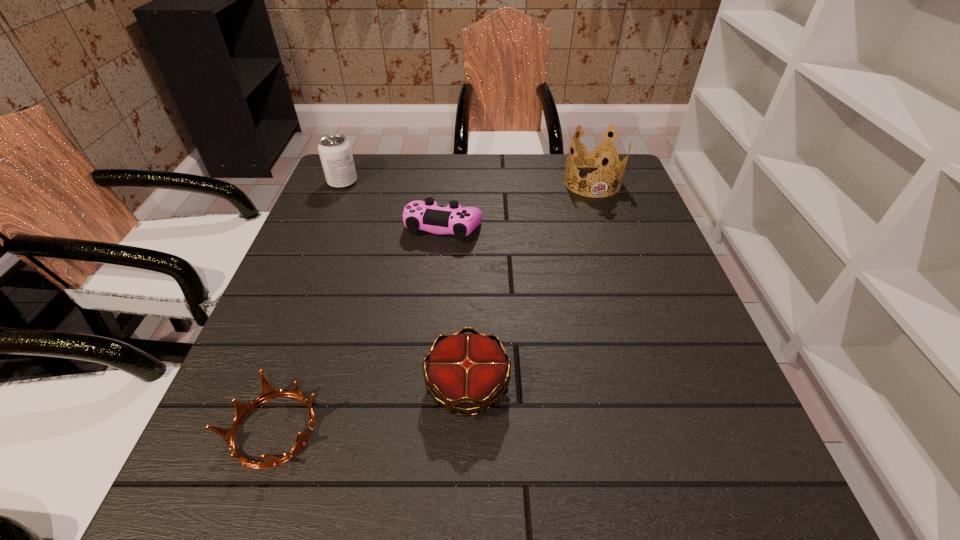
You are a GUI agent. You are given a task and a screenshot of the screen. Output one action in this format:
    pyautogui.click(x=<x>, y=<y>)
    Task: Click on the vacant space located 0.390m on the right of the third nearest object
    
    Given the screenshot: What is the action you would take?
    pyautogui.click(x=641, y=227)

Locate an element on the screen. vacant point located 0.240m on the right of the shortest object is located at coordinates (471, 430).

Identify the location of crown situated at the far edge. (597, 155).

Identify the location of soda can situated at the far edge. tap(335, 152).

Image resolution: width=960 pixels, height=540 pixels. Find the location of `object that is at the near edge`. object that is at the near edge is located at coordinates (268, 392).

This screenshot has height=540, width=960. Identify the location of soda can located at the left edge. (335, 152).

The height and width of the screenshot is (540, 960). I want to click on crown that is at the left edge, so click(x=268, y=392).

Locate an element on the screen. This screenshot has height=540, width=960. object that is at the right edge is located at coordinates (597, 155).

I want to click on object that is at the far left corner, so pos(335,152).

Where is `object that is positioned at the near left corner`? Image resolution: width=960 pixels, height=540 pixels. object that is positioned at the near left corner is located at coordinates (268, 392).